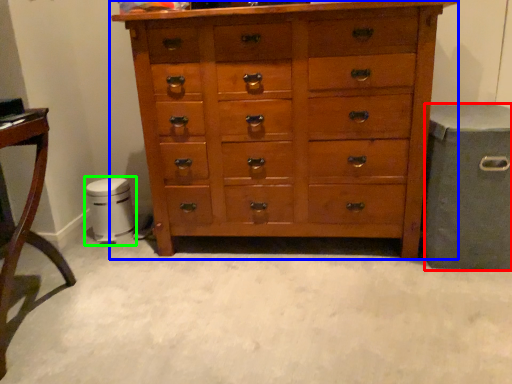
Question: Which object is positioned farthest from gray (highlighted by a red box)? Select from chest of drawers (highlighted by a blue box) and music stool (highlighted by a green box).

Choices:
 (A) chest of drawers
 (B) music stool

Answer: (B)